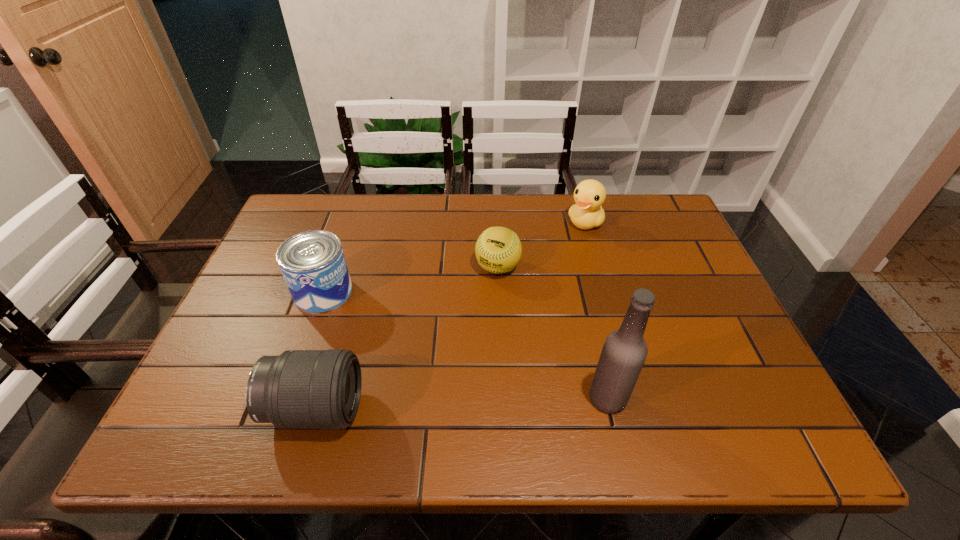
What are the coordinates of `telephoto lens` in the screenshot? It's located at [x=300, y=389].

Find the location of `beer bottle`. beer bottle is located at coordinates (624, 352).

Identify the location of softball. (498, 250).

This screenshot has width=960, height=540. What are the coordinates of `the shortest object` in the screenshot? It's located at (498, 250).

Image resolution: width=960 pixels, height=540 pixels. I want to click on duck, so click(589, 195).

At what (x,y) coordinates should I click in order to perform the action: click on can. Please return your answer as a coordinate pair (x, y). Image resolution: width=960 pixels, height=540 pixels. Looking at the image, I should click on (313, 265).

The height and width of the screenshot is (540, 960). Identify the location of vacant space located 0.090m on the label of the beer bottle. (671, 398).

Locate an element on the screen. This screenshot has height=540, width=960. vacant position located 0.220m on the logo side of the third object from left to right is located at coordinates (457, 347).

This screenshot has height=540, width=960. What are the coordinates of `free space located 0.170m on the logo side of the third object from left to right` in the screenshot? It's located at (465, 330).

Where is `vacant area situated 0.080m on the logo side of the third object from left to right`? The height and width of the screenshot is (540, 960). vacant area situated 0.080m on the logo side of the third object from left to right is located at coordinates (479, 303).